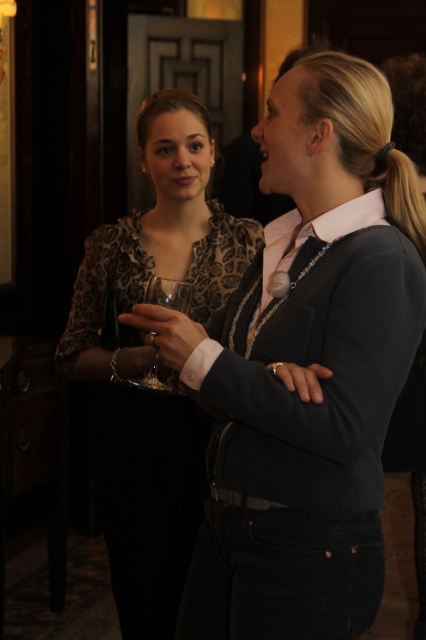
Is dark blue corduroy blazer at center above clear glass at center?

Actually, dark blue corduroy blazer at center is below clear glass at center.

Which is behind, point (291, 516) or point (164, 298)?

Point (164, 298)

Is point (409, 250) more distant than point (152, 337)?

No, (409, 250) is in front of (152, 337).

The width and height of the screenshot is (426, 640). Identify the location of dark blue corduroy blazer at center. (302, 428).

Between dark blue corduroy blazer at center and matte brown blouse at center, which one is positioned higher?

matte brown blouse at center is higher up.

Does dark blue corduroy blazer at center have a larger size compared to matte brown blouse at center?

Actually, dark blue corduroy blazer at center might be smaller than matte brown blouse at center.

Is point (196, 572) behind point (204, 413)?

No, it is not.

Where is `dark blue corduroy blazer at center`? The width and height of the screenshot is (426, 640). dark blue corduroy blazer at center is located at coordinates (302, 428).

Is the position of matte brown blouse at center less distant than that of clear glass at center?

No.

Find the location of a particular element. The image size is (426, 640). matte brown blouse at center is located at coordinates (150, 360).